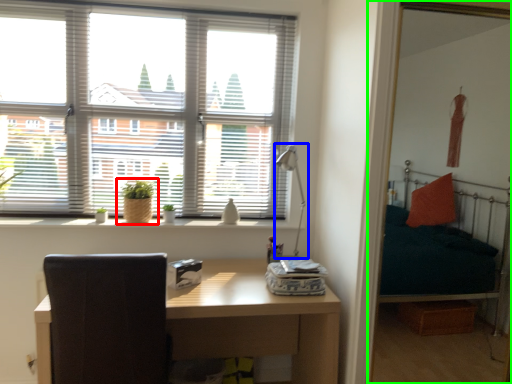
Question: Which object is positioned closest to houseplant (highlighted by a red box)? Select from table lamp (highlighted by a blue box) and bunk bed (highlighted by a green box).

Choices:
 (A) table lamp
 (B) bunk bed

Answer: (A)